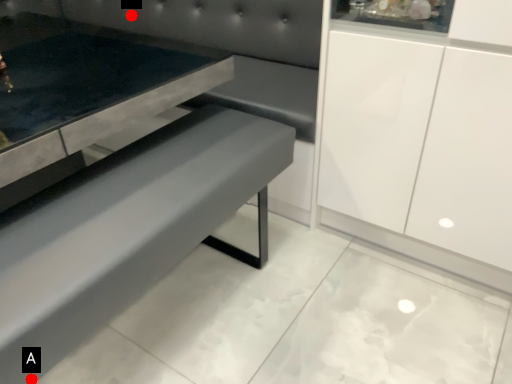
Question: Two points are circled on the image, labeled by A and B beside each circle. Which point is farther from the camera taking this photo?

Choices:
 (A) A is further
 (B) B is further

Answer: (B)